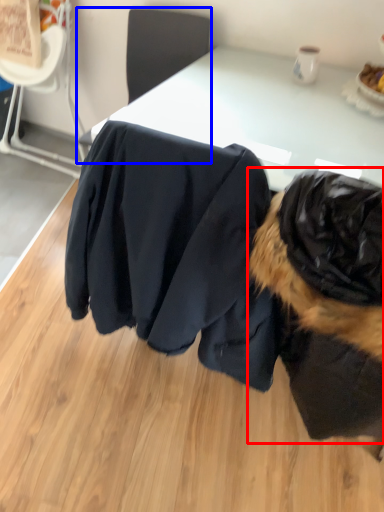
Question: Which object is further to the camera taking this photo, dog (highlighted by a red box) or chair (highlighted by a blue box)?

Choices:
 (A) dog
 (B) chair

Answer: (B)